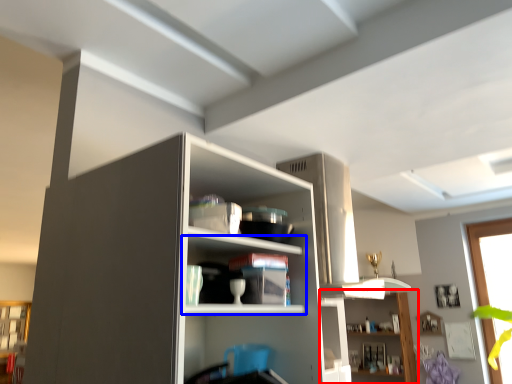
Question: Which of the following is the farthest to the observer, shelf (highlighted by a red box) or shelf (highlighted by a blue box)?

Choices:
 (A) shelf
 (B) shelf

Answer: (A)